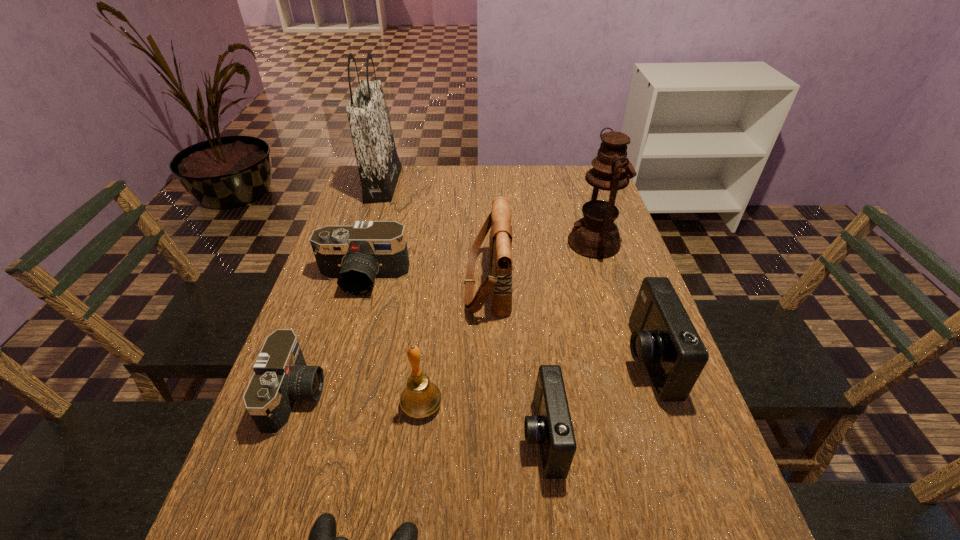
At what (x,y) coordinates should I click in order to perform the action: click on vacant point located on the front-facing side of the rightmost camera. Please return your answer as a coordinate pair (x, y). Looking at the image, I should click on (592, 360).

The width and height of the screenshot is (960, 540). In order to click on free space located on the front-facing side of the farther black camera in this screenshot , I will do `click(325, 413)`.

This screenshot has height=540, width=960. I want to click on vacant space situated 0.160m on the front-facing side of the third camera from left to right, so click(441, 436).

Where is `blank space located on the front-facing side of the third camera from left to right`? The height and width of the screenshot is (540, 960). blank space located on the front-facing side of the third camera from left to right is located at coordinates (451, 436).

Locate an element on the screen. Image resolution: width=960 pixels, height=540 pixels. vacant area situated 0.070m on the front-facing side of the third camera from left to right is located at coordinates (487, 436).

Locate an element on the screen. free location located 0.360m on the front-facing side of the smaller black camera is located at coordinates (493, 395).

Image resolution: width=960 pixels, height=540 pixels. I want to click on object located in the far edge section of the desktop, so click(x=379, y=167).

The height and width of the screenshot is (540, 960). Identify the location of shopping bag that is at the left edge. (379, 167).

Where is `oil lamp located in the right edge section of the desktop`? oil lamp located in the right edge section of the desktop is located at coordinates (595, 236).

The width and height of the screenshot is (960, 540). What are the coordinates of `camera located at the right edge` in the screenshot? It's located at (663, 336).